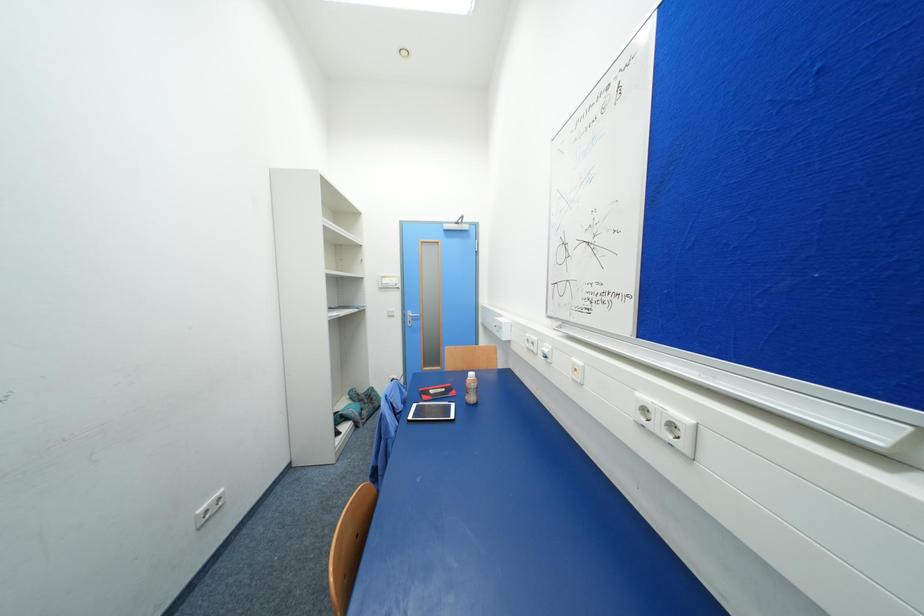
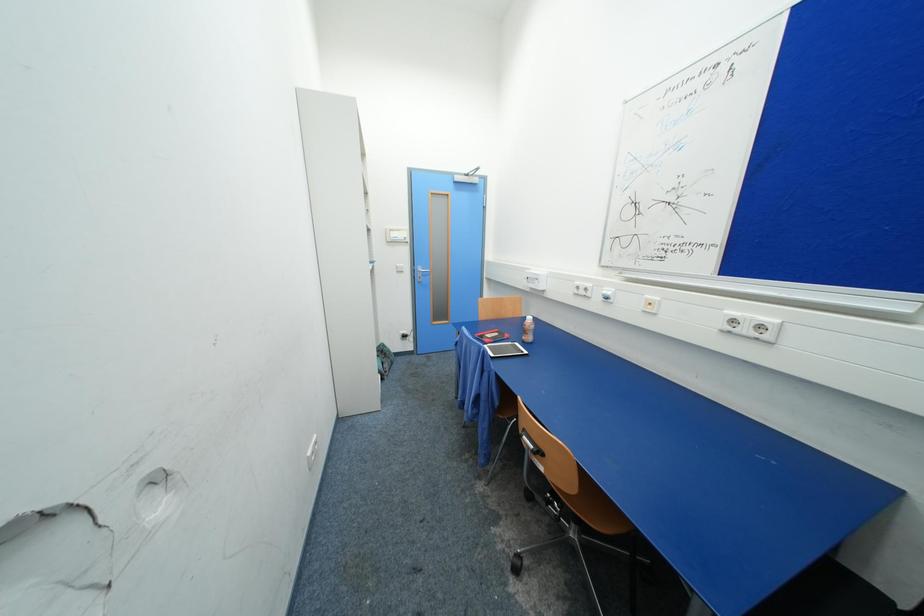
Question: The camera is either moving clockwise (left) or counter-clockwise (right) around the object. The first image is from the beginning of the video and the second image is from the end. Is the camera moving left or right when shooting the video?

Choices:
 (A) Left
 (B) Right

Answer: (A)